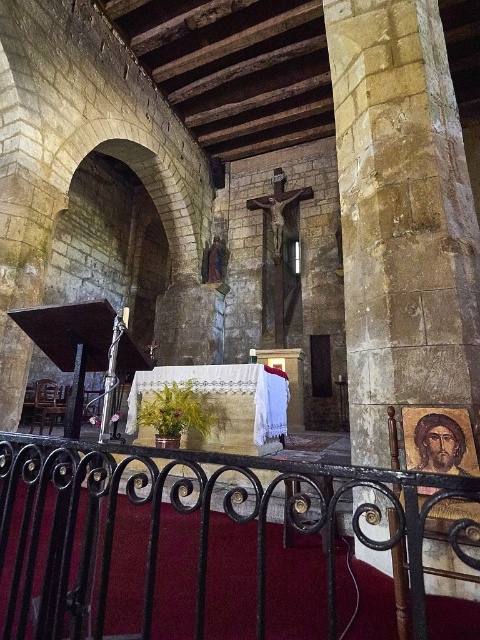
Question: Is black wrought iron railing at center wider than yellow stone pillar at center?

Choices:
 (A) yes
 (B) no

Answer: (A)

Question: Among these points, which one is nearest to the camera?

Choices:
 (A) (362, 580)
 (B) (417, 35)

Answer: (A)

Question: Can you confirm if black wrought iron railing at center is positioned above yellow stone pillar at center?

Choices:
 (A) no
 (B) yes

Answer: (A)

Question: Which point is farther to the camera?

Choices:
 (A) yellow stone pillar at center
 (B) black wrought iron railing at center

Answer: (A)

Question: Observing the image, what is the correct spatial positioning of black wrought iron railing at center in reference to yellow stone pillar at center?

Choices:
 (A) right
 (B) left

Answer: (B)